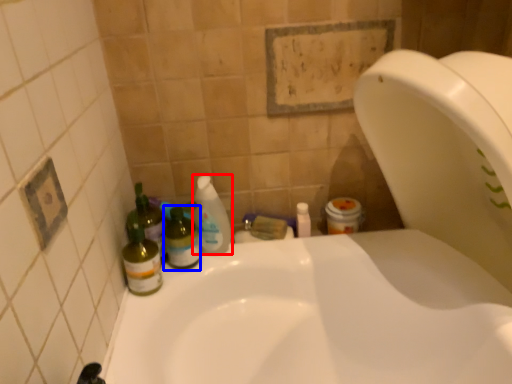
Question: Which of the following is the farthest to the observer, cleaning product (highlighted by a red box) or bottle (highlighted by a blue box)?

Choices:
 (A) cleaning product
 (B) bottle

Answer: (A)